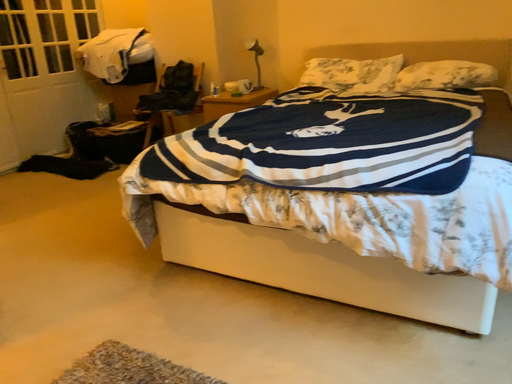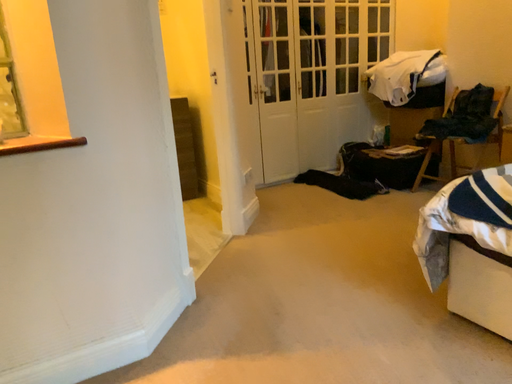
Question: Which way did the camera rotate in the video?

Choices:
 (A) rotated upward
 (B) rotated downward

Answer: (A)